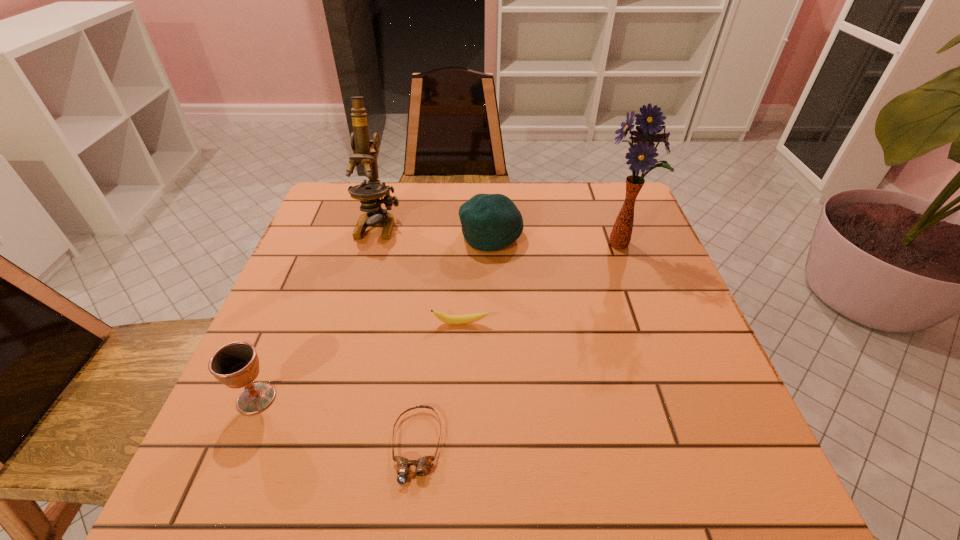
The height and width of the screenshot is (540, 960). In order to click on vacant space that is in between the shortest object and the chalice in this screenshot , I will do `click(336, 422)`.

The image size is (960, 540). Identify the location of free space between the beanie and the shortest object. (454, 341).

Locate an element on the screen. Image resolution: width=960 pixels, height=540 pixels. vacant area that lies between the rightmost object and the second shortest object is located at coordinates (540, 284).

I want to click on free space between the shortest object and the third nearest object, so click(x=439, y=384).

The image size is (960, 540). In order to click on free spot between the leftmost object and the beanie in this screenshot , I will do `click(373, 317)`.

This screenshot has height=540, width=960. In order to click on vacant space that's between the goggles and the leftmost object in this screenshot , I will do `click(336, 422)`.

This screenshot has height=540, width=960. Identify the location of vacant space that's between the rightmost object and the chalice. (439, 322).

Image resolution: width=960 pixels, height=540 pixels. Find the location of `the second closest object relative to the chalice`. the second closest object relative to the chalice is located at coordinates (468, 318).

Identify which object is the fifth closest to the leftmost object. Please provide its 2D coordinates. Your answer should be formatted as a tuple, i.e. [(x, y)], where the tuple contains the x and y coordinates of a point satisfying the conditions above.

[(641, 155)]

Locate an element on the screen. free space that satisfies the following two spatial constraints: 1. on the front side of the microscope; 2. on the right side of the flower arrangement is located at coordinates (372, 245).